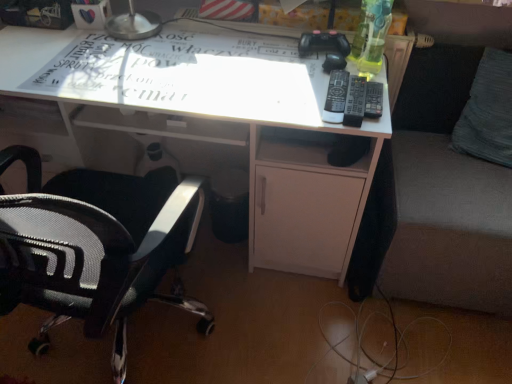
The image size is (512, 384). Identify the location of free region under black mesh office chair at left (from a real-world perspective). (128, 340).